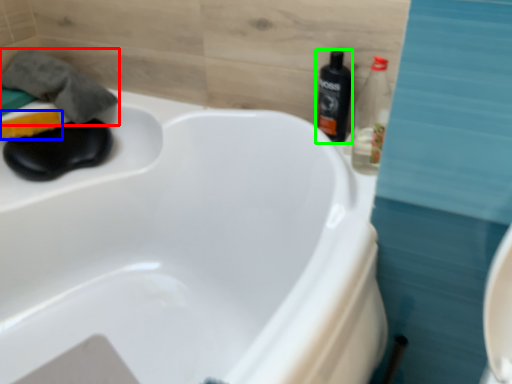
Question: Which object is the closest to the bath towel (highlighted by a red box)? Choose among these: soap (highlighted by a blue box) or bottle (highlighted by a green box).

Choices:
 (A) soap
 (B) bottle

Answer: (A)